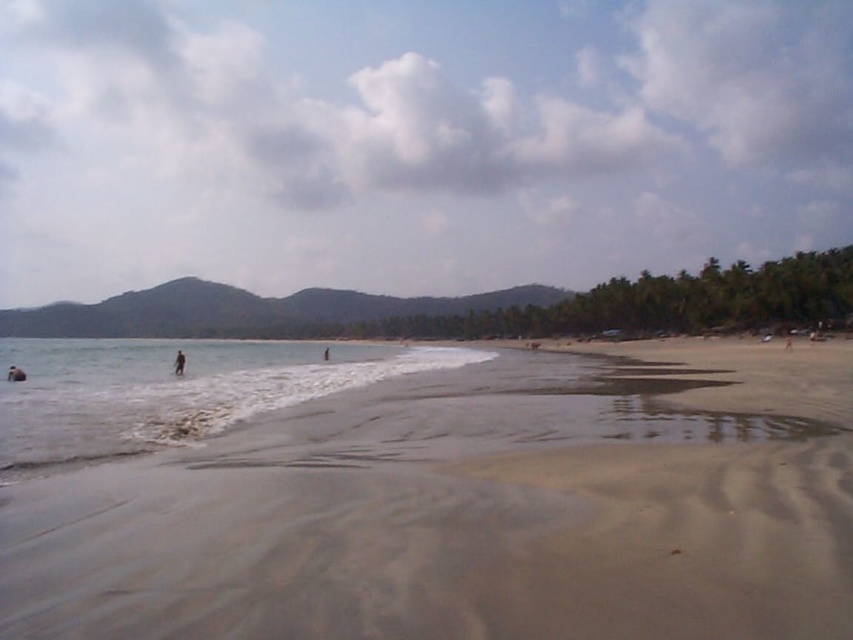
Measure the distance between clear water at lower left and camera.

clear water at lower left is 8.93 meters from camera.

Who is lower down, clear water at lower left or skinny person at lower right?

clear water at lower left

At what (x,y) coordinates should I click in order to perform the action: click on clear water at lower left. Please return your answer as a coordinate pair (x, y). The width and height of the screenshot is (853, 640). Looking at the image, I should click on (170, 390).

This screenshot has width=853, height=640. Identify the location of clear water at lower left. (170, 390).

Who is positioned more to the left, sandy beach at lower center or skinny person at lower right?

sandy beach at lower center

Who is positioned more to the right, sandy beach at lower center or skinny person at lower right?

From the viewer's perspective, skinny person at lower right appears more on the right side.

The height and width of the screenshot is (640, 853). Find the location of `sandy beach at lower center`. sandy beach at lower center is located at coordinates (422, 492).

Identify the location of sandy beach at lower center. The height and width of the screenshot is (640, 853). (422, 492).

Which is above, clear water at lower left or smooth skin person at lower left?

Positioned higher is smooth skin person at lower left.

Does clear water at lower left have a smaller size compared to smooth skin person at lower left?

Incorrect, clear water at lower left is not smaller in size than smooth skin person at lower left.

In order to click on clear water at lower left in this screenshot , I will do `click(170, 390)`.